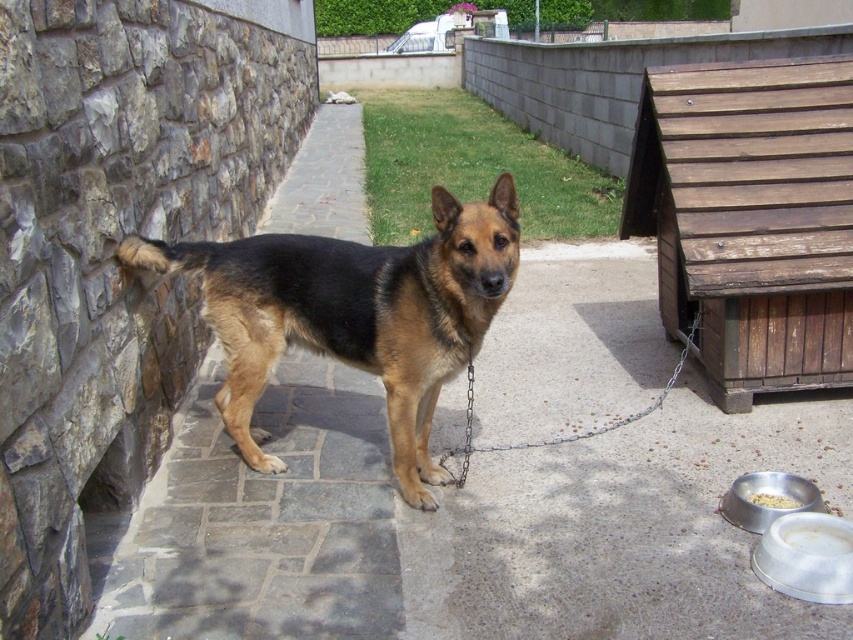
You are a delivery person who needs to place a package on the ground near the black and tan fur dog at center and the white matte bowl at lower right. Where should you place it so it doesn

The black and tan fur dog at center is in front of the white matte bowl at lower right, so placing the package between them would ensure it is near both objects.

You are a delivery person holding a 1.8 meter long package that needs to be placed on the ground. You are standing 2 meters away from the black and tan fur dog at center. Can you place the package on the ground without moving closer to the dog?

The distance between you and the black and tan fur dog at center is 2.16 meters, which is greater than the 1.8 meter length of the package. Therefore, you can safely extend the package towards the dog without needing to move closer, as the package can span the distance between you and the dog.

From the picture: You are a delivery person who needs to place a package on the ground near the black and tan fur dog at center and the white matte bowl at lower right. Considering their sizes, which object should you avoid placing the package too close to?

The black and tan fur dog at center has a larger width than the white matte bowl at lower right, so you should avoid placing the package too close to the black and tan fur dog at center to prevent obstruction.